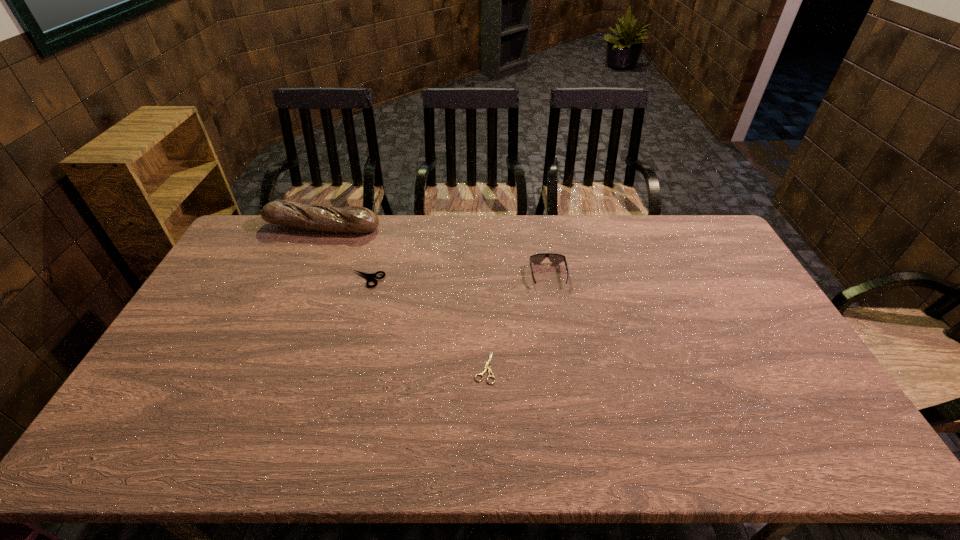
Where is `vacant point located between the third shortest object and the left shears`? vacant point located between the third shortest object and the left shears is located at coordinates (458, 277).

Locate an element on the screen. Image resolution: width=960 pixels, height=540 pixels. vacant area between the right shears and the rightmost object is located at coordinates (516, 321).

Find the location of a particular element. Image resolution: width=960 pixels, height=540 pixels. vacant area that lies between the baguet and the farther shears is located at coordinates (346, 253).

Where is `vacant area that lies between the rightmost object and the right shears`? The height and width of the screenshot is (540, 960). vacant area that lies between the rightmost object and the right shears is located at coordinates (516, 321).

Where is `unoccupied position between the baguet and the rightmost object`? unoccupied position between the baguet and the rightmost object is located at coordinates (435, 251).

Find the location of a particular element. The image size is (960, 540). free space between the nearest object and the tallest object is located at coordinates pos(403,297).

Identify the location of vacant area between the farthest object and the shorter shears. (403, 297).

Find the location of a particular element. free space between the baguet and the rightmost object is located at coordinates (435, 251).

The image size is (960, 540). In order to click on empty space between the nearer shears and the farthest object in this screenshot , I will do `click(403, 297)`.

Where is `the closest object to the farthest object`? This screenshot has height=540, width=960. the closest object to the farthest object is located at coordinates (368, 276).